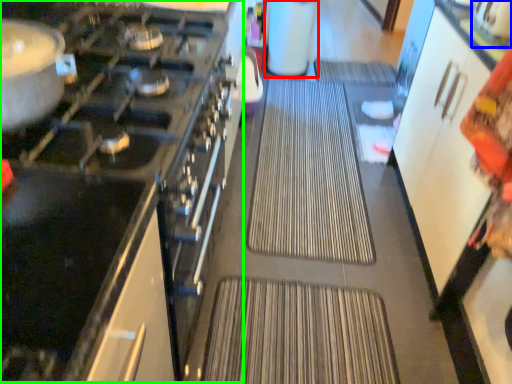
Question: Estimate the real-world distances between objects in this image. Which object is closer to appliance (highlighted by a red box), appliance (highlighted by a blue box) or appliance (highlighted by a green box)?

Choices:
 (A) appliance
 (B) appliance

Answer: (A)